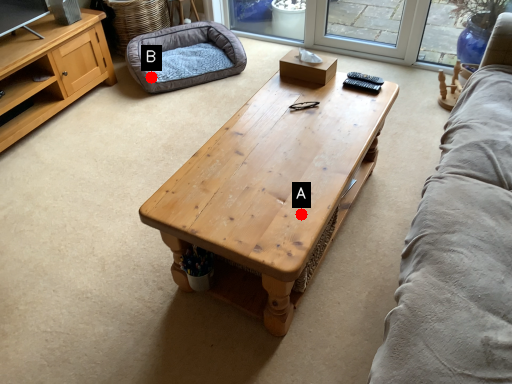
Question: Two points are circled on the image, labeled by A and B beside each circle. Which point is closer to the camera?

Choices:
 (A) A is closer
 (B) B is closer

Answer: (A)